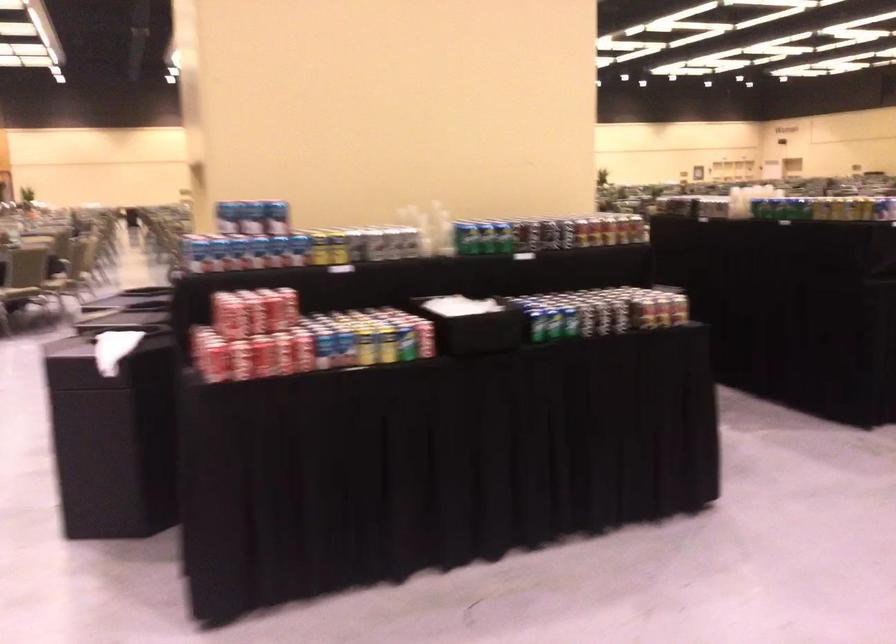
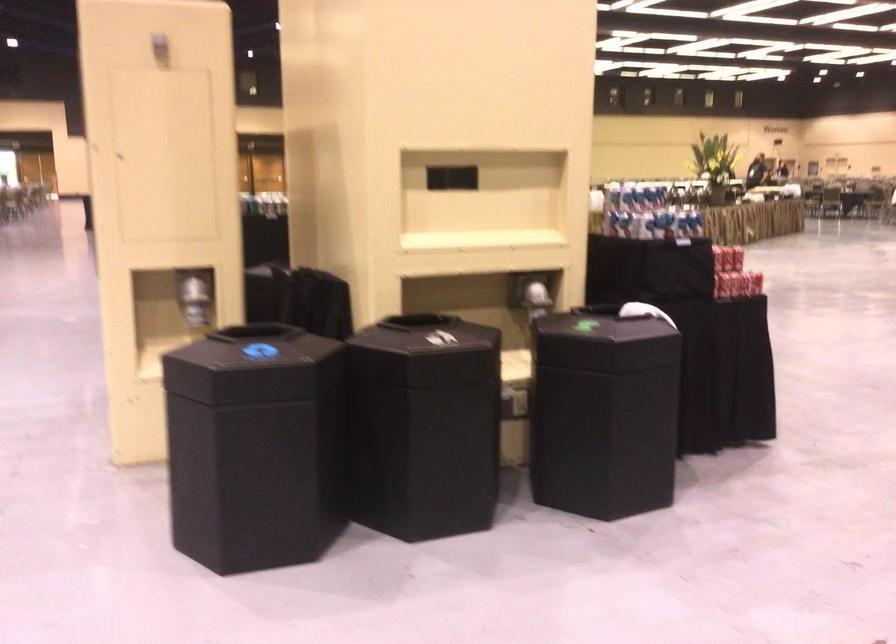
Question: I am providing you with two images of the same scene from different viewpoints. Please identify which objects are invisible in image2.

Choices:
 (A) small fridge magnet
 (B) black bin lid
 (C) blue soda can
 (D) shiny dispenser lever

Answer: (C)